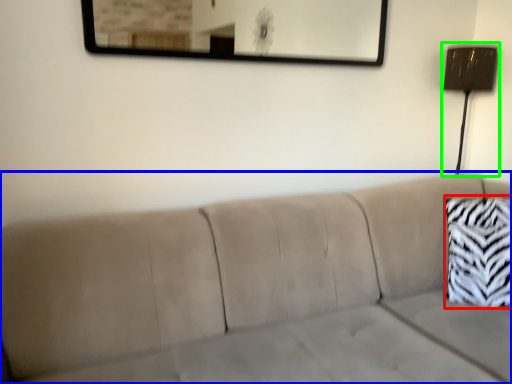
Question: Which object is positioned closest to throw pillow (highlighted by a red box)? Select from studio couch (highlighted by a blue box) and lamp (highlighted by a green box).

Choices:
 (A) studio couch
 (B) lamp

Answer: (A)